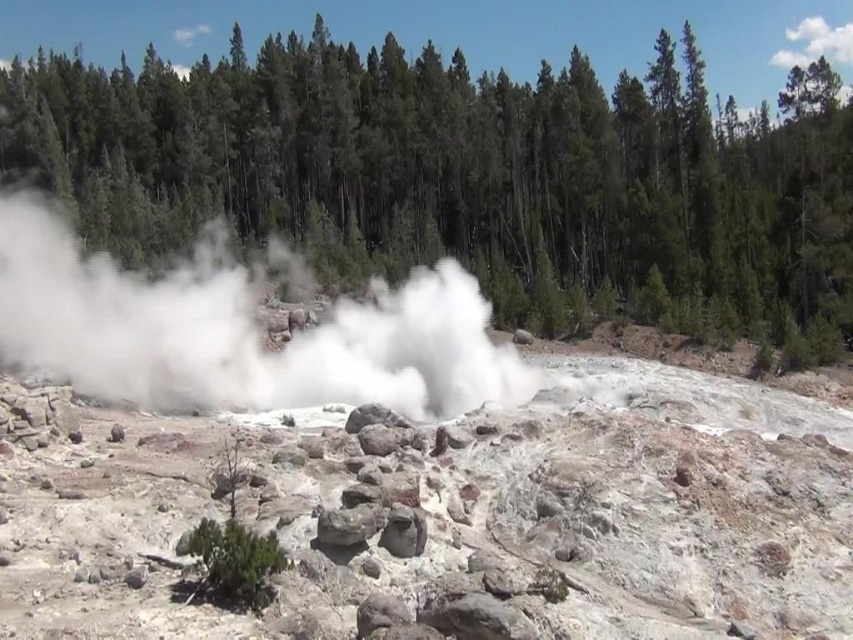
You are a hiker who wants to take a photo of the white vapor at center and the green textured trees at center from a distance. Which object will appear larger in the photo?

The green textured trees at center will appear larger in the photo because it is much taller than the white vapor at center.

You are a park ranger assessing the geothermal area. You notice the green textured trees at center and the white vapor at center. Which object occupies a greater area in the scene?

The green textured trees at center is larger in size than the white vapor at center, so it occupies a greater area in the scene.